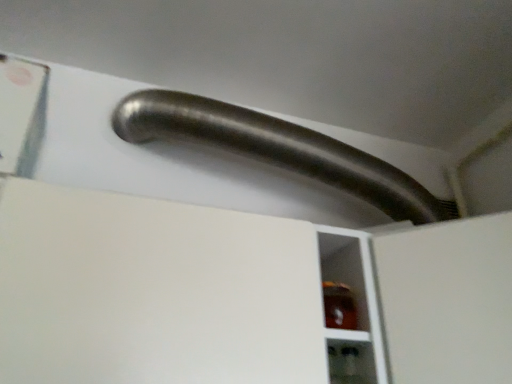
Describe the element at coordinates (278, 149) in the screenshot. Image resolution: width=512 pixels, height=384 pixels. I see `polished metal handle at upper center` at that location.

Locate an element on the screen. This screenshot has height=384, width=512. polished metal handle at upper center is located at coordinates (278, 149).

What is the approximate width of polished metal handle at upper center?

polished metal handle at upper center is 51.61 centimeters in width.

You are a GUI agent. You are given a task and a screenshot of the screen. Output one action in this format:
    pyautogui.click(x=<x>, y=<y>)
    Task: Click on the polished metal handle at upper center
    
    Given the screenshot: What is the action you would take?
    pyautogui.click(x=278, y=149)